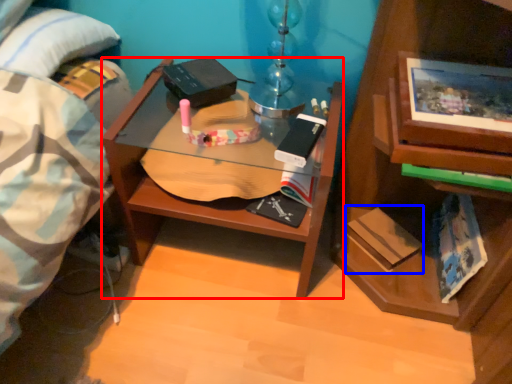
Question: Which object appears farthest to the camera in this image, desk (highlighted by a red box) or paperback book (highlighted by a blue box)?

Choices:
 (A) desk
 (B) paperback book

Answer: (B)